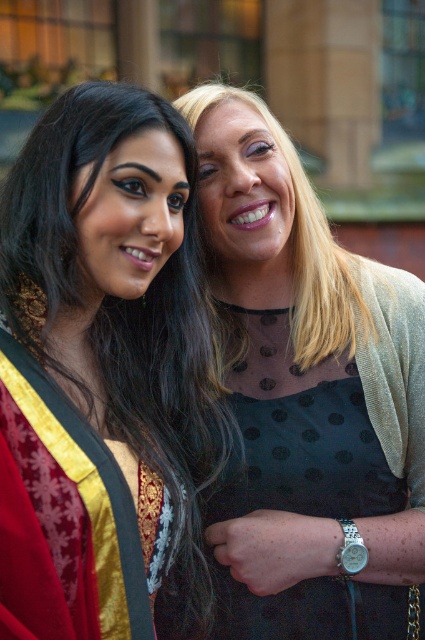
Question: Which object is closer to the camera taking this photo?

Choices:
 (A) matte black dress at center
 (B) black dotted dress at center

Answer: (A)

Question: Is matte black dress at center positioned in front of black dotted dress at center?

Choices:
 (A) yes
 (B) no

Answer: (A)

Question: Which point appears farthest from the camera in this image?

Choices:
 (A) (325, 564)
 (B) (44, 420)

Answer: (A)

Question: Is matte black dress at center thinner than black dotted dress at center?

Choices:
 (A) no
 (B) yes

Answer: (B)

Question: Is matte black dress at center thinner than black dotted dress at center?

Choices:
 (A) no
 (B) yes

Answer: (B)